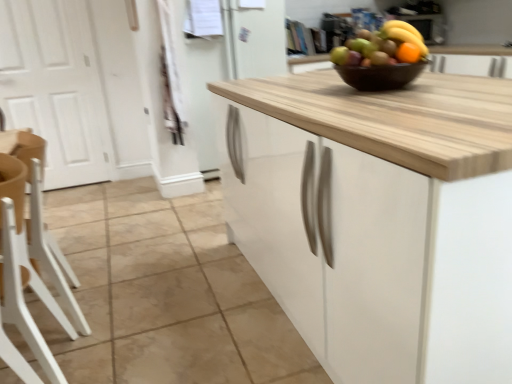
Question: From a real-world perspective, is orange matte grapefruit at upper center on white wood chair at left, the 1th chair viewed from the back?

Choices:
 (A) yes
 (B) no

Answer: (A)

Question: Is orange matte grapefruit at upper center bigger than white wood chair at left, the 1th chair viewed from the back?

Choices:
 (A) yes
 (B) no

Answer: (B)

Question: Is orange matte grapefruit at upper center not near white wood chair at left, which is the 2th chair from front to back?

Choices:
 (A) yes
 (B) no

Answer: (A)

Question: Does orange matte grapefruit at upper center have a greater height compared to white wood chair at left, which is the 2th chair from front to back?

Choices:
 (A) yes
 (B) no

Answer: (B)

Question: Is the depth of orange matte grapefruit at upper center greater than that of white wood chair at left, which is the 2th chair from front to back?

Choices:
 (A) no
 (B) yes

Answer: (A)

Question: Considering the relative positions of yellow matte bananas at upper center and white plastic chair at lower left, the 2th chair positioned from the back, in the image provided, is yellow matte bananas at upper center to the left or to the right of white plastic chair at lower left, the 2th chair positioned from the back,?

Choices:
 (A) left
 (B) right

Answer: (B)

Question: From a real-world perspective, relative to white plastic chair at lower left, the 2th chair positioned from the back, is yellow matte bananas at upper center vertically above or below?

Choices:
 (A) below
 (B) above

Answer: (B)

Question: Is yellow matte bananas at upper center in front of or behind white plastic chair at lower left, the 1th chair in the front-to-back sequence, in the image?

Choices:
 (A) behind
 (B) front

Answer: (A)

Question: Looking at the image, does yellow matte bananas at upper center seem bigger or smaller compared to white plastic chair at lower left, the 1th chair in the front-to-back sequence?

Choices:
 (A) big
 (B) small

Answer: (B)

Question: From the image's perspective, is white plastic chair at lower left, the 1th chair in the front-to-back sequence, above or below orange matte grapefruit at upper center?

Choices:
 (A) below
 (B) above

Answer: (A)

Question: Is white plastic chair at lower left, the 2th chair positioned from the back, inside the boundaries of orange matte grapefruit at upper center, or outside?

Choices:
 (A) outside
 (B) inside

Answer: (A)

Question: Considering the positions of white plastic chair at lower left, the 2th chair positioned from the back, and orange matte grapefruit at upper center in the image, is white plastic chair at lower left, the 2th chair positioned from the back, taller or shorter than orange matte grapefruit at upper center?

Choices:
 (A) tall
 (B) short

Answer: (A)

Question: Is white plastic chair at lower left, the 1th chair in the front-to-back sequence, in front of or behind orange matte grapefruit at upper center in the image?

Choices:
 (A) behind
 (B) front

Answer: (B)

Question: Is yellow matte bananas at upper center to the left or to the right of orange matte grapefruit at upper center in the image?

Choices:
 (A) right
 (B) left

Answer: (A)

Question: Is yellow matte bananas at upper center bigger or smaller than orange matte grapefruit at upper center?

Choices:
 (A) big
 (B) small

Answer: (A)